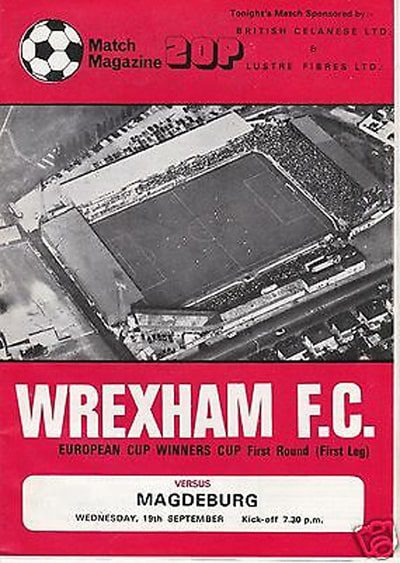
Identify the location of fans. (324, 252), (266, 279), (219, 301), (270, 129), (345, 195), (226, 151), (168, 174).